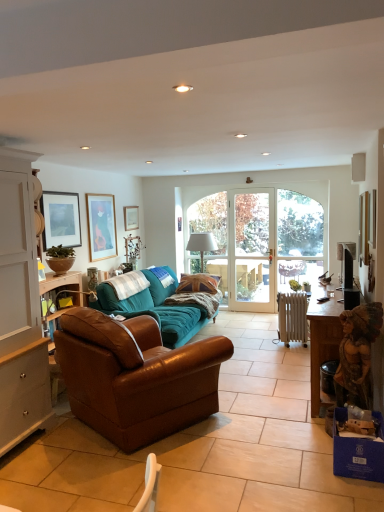
Question: From the image's perspective, is white wood cabinet at left positioned above or below teal fabric couch at center, which is counted as the first studio couch, starting from the back?

Choices:
 (A) below
 (B) above

Answer: (B)

Question: Looking at the image, does white wood cabinet at left seem bigger or smaller compared to teal fabric couch at center, the 2th studio couch positioned from the front?

Choices:
 (A) big
 (B) small

Answer: (B)

Question: Estimate the real-world distances between objects in this image. Which object is closer to the clear glass door at center?

Choices:
 (A) black plastic remote control at lower right
 (B) white fabric lampshade at center
 (C) green matte bowl at left
 (D) white plastic speaker at upper right
 (E) metallic silver picture frame at upper right, placed as the 4th picture frame when sorted from back to front

Answer: (B)

Question: Estimate the real-world distances between objects in this image. Which object is farther from the clear glass door at center?

Choices:
 (A) clear glass door at center
 (B) brown leather couch at center, which is the 1th studio couch from front to back
 (C) white plastic speaker at upper right
 (D) white fabric lampshade at center
 (E) black plastic remote control at lower right

Answer: (B)